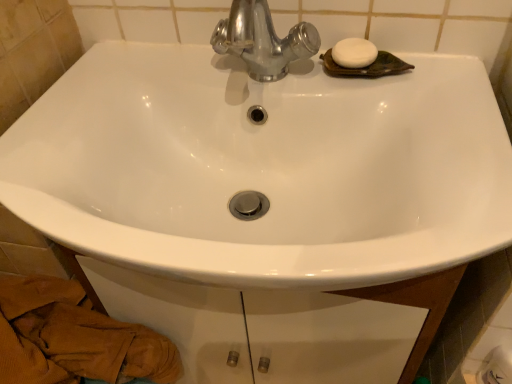
What do you see at coordinates (354, 53) in the screenshot? The image size is (512, 384). I see `white matte soap at upper right` at bounding box center [354, 53].

What do you see at coordinates (496, 366) in the screenshot?
I see `white glossy toilet paper at lower right` at bounding box center [496, 366].

Measure the distance between white glossy toilet paper at lower right and camera.

They are 23.43 inches apart.

The height and width of the screenshot is (384, 512). What do you see at coordinates (73, 338) in the screenshot?
I see `brown textured towel at lower left` at bounding box center [73, 338].

I want to click on white matte soap at upper right, so click(x=354, y=53).

Between white glossy toilet paper at lower right and white matte soap at upper right, which one has smaller width?

Thinner between the two is white glossy toilet paper at lower right.

From the image's perspective, relative to white matte soap at upper right, is white glossy toilet paper at lower right above or below?

white glossy toilet paper at lower right is below white matte soap at upper right.

There is a white glossy toilet paper at lower right. What are the coordinates of `soap above it (from a real-world perspective)` in the screenshot? It's located at (354, 53).

How distant is brown textured towel at lower left from white matte soap at upper right?

The distance of brown textured towel at lower left from white matte soap at upper right is 61.71 centimeters.

Based on their positions, is brown textured towel at lower left located to the left or right of white matte soap at upper right?

In the image, brown textured towel at lower left appears on the left side of white matte soap at upper right.

Can you tell me how much brown textured towel at lower left and white matte soap at upper right differ in facing direction?

1.33 degrees separate the facing orientations of brown textured towel at lower left and white matte soap at upper right.

Is brown textured towel at lower left taller than white matte soap at upper right?

Indeed, brown textured towel at lower left has a greater height compared to white matte soap at upper right.

Is point (375, 49) closer to camera compared to point (498, 372)?

No.

Could you tell me if white matte soap at upper right is facing white glossy toilet paper at lower right?

No, white matte soap at upper right is not aimed at white glossy toilet paper at lower right.

Considering the relative sizes of white matte soap at upper right and white glossy toilet paper at lower right in the image provided, is white matte soap at upper right bigger than white glossy toilet paper at lower right?

Incorrect, white matte soap at upper right is not larger than white glossy toilet paper at lower right.

Between white matte soap at upper right and white glossy toilet paper at lower right, which one has larger width?

white matte soap at upper right.

From a real-world perspective, who is located higher, brown textured towel at lower left or white glossy toilet paper at lower right?

From a 3D spatial view, white glossy toilet paper at lower right is above.

Considering the relative sizes of brown textured towel at lower left and white glossy toilet paper at lower right in the image provided, is brown textured towel at lower left smaller than white glossy toilet paper at lower right?

Incorrect, brown textured towel at lower left is not smaller in size than white glossy toilet paper at lower right.

How different are the orientations of brown textured towel at lower left and white glossy toilet paper at lower right in degrees?

0.000803 degrees separate the facing orientations of brown textured towel at lower left and white glossy toilet paper at lower right.

Consider the image. Is white matte soap at upper right to the right of brown textured towel at lower left from the viewer's perspective?

Indeed, white matte soap at upper right is positioned on the right side of brown textured towel at lower left.

Are white matte soap at upper right and brown textured towel at lower left far apart?

No.

Is white matte soap at upper right shorter than brown textured towel at lower left?

Yes, white matte soap at upper right is shorter than brown textured towel at lower left.

Is white glossy toilet paper at lower right at the left side of brown textured towel at lower left?

In fact, white glossy toilet paper at lower right is to the right of brown textured towel at lower left.

In the scene shown: Is white glossy toilet paper at lower right smaller than brown textured towel at lower left?

Correct, white glossy toilet paper at lower right occupies less space than brown textured towel at lower left.

From the picture: Which point is more forward, (489, 379) or (33, 373)?

The point (33, 373) is closer.

In order to click on toilet paper that is above the brown textured towel at lower left (from a real-world perspective) in this screenshot , I will do `click(496, 366)`.

The image size is (512, 384). I want to click on toilet paper lying in front of the white matte soap at upper right, so (496, 366).

You are a GUI agent. You are given a task and a screenshot of the screen. Output one action in this format:
    pyautogui.click(x=<x>, y=<y>)
    Task: Click on the material on the left of the white matte soap at upper right
    The height and width of the screenshot is (384, 512).
    Given the screenshot: What is the action you would take?
    pyautogui.click(x=73, y=338)

From the image, which object appears to be farther from white matte soap at upper right, brown textured towel at lower left or white glossy toilet paper at lower right?

The object further to white matte soap at upper right is brown textured towel at lower left.

When comparing their distances from white glossy toilet paper at lower right, does white matte soap at upper right or brown textured towel at lower left seem closer?

white matte soap at upper right lies closer to white glossy toilet paper at lower right than the other object.

Which object lies nearer to the anchor point brown textured towel at lower left, white glossy toilet paper at lower right or white matte soap at upper right?

Based on the image, white matte soap at upper right appears to be nearer to brown textured towel at lower left.

In the scene shown: Which object lies further to the anchor point brown textured towel at lower left, white matte soap at upper right or white glossy toilet paper at lower right?

white glossy toilet paper at lower right is positioned further to the anchor brown textured towel at lower left.

Looking at the image, which one is located closer to white matte soap at upper right, white glossy toilet paper at lower right or brown textured towel at lower left?

The object closer to white matte soap at upper right is white glossy toilet paper at lower right.

Estimate the real-world distances between objects in this image. Which object is further from white glossy toilet paper at lower right, brown textured towel at lower left or white matte soap at upper right?

Among the two, brown textured towel at lower left is located further to white glossy toilet paper at lower right.

Identify the location of soap between brown textured towel at lower left and white glossy toilet paper at lower right from left to right. (354, 53).